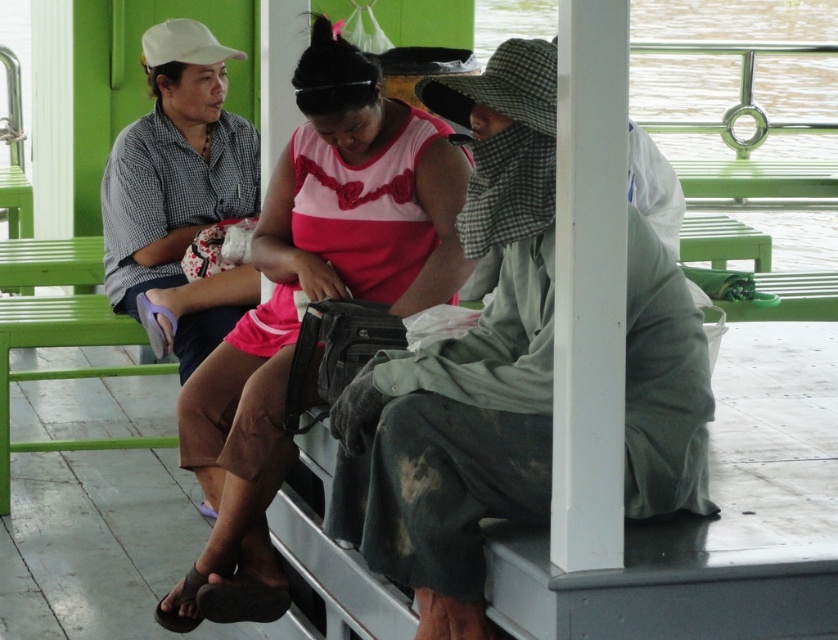
What object is located at the coordinate point (464, 369) in the image?

The point at (464, 369) marks the green fabric hat at center.

You are a photographer standing in front of the scene. You want to take a photo of the green fabric hat at center and the pink matte dress at center. Which object will appear smaller in the photo?

The green fabric hat at center is positioned under the pink matte dress at center, so the pink matte dress at center will appear smaller in the photo because it is farther away from the camera.

Which object is closer to the viewer, the green fabric hat at center or the pink top with red floral?

The green fabric hat at center is closer to the viewer than the pink top with red floral because it is positioned at point (464, 369), which is closer in the scene coordinates.